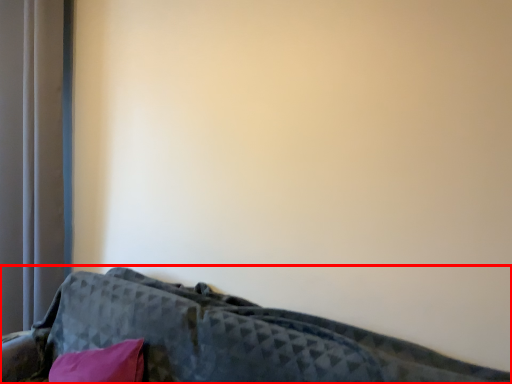
Question: From the image's perspective, what is the correct spatial relationship of furniture (annotated by the red box) in relation to curtain?

Choices:
 (A) above
 (B) below

Answer: (B)